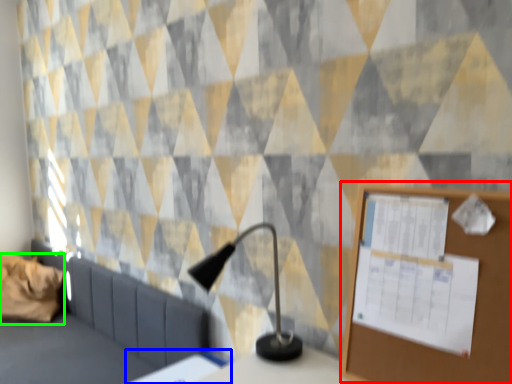
Question: Considering the real-world distances, which object is farthest from bulletin board (highlighted by a red box)? table (highlighted by a blue box) or pillow (highlighted by a green box)?

Choices:
 (A) table
 (B) pillow

Answer: (B)